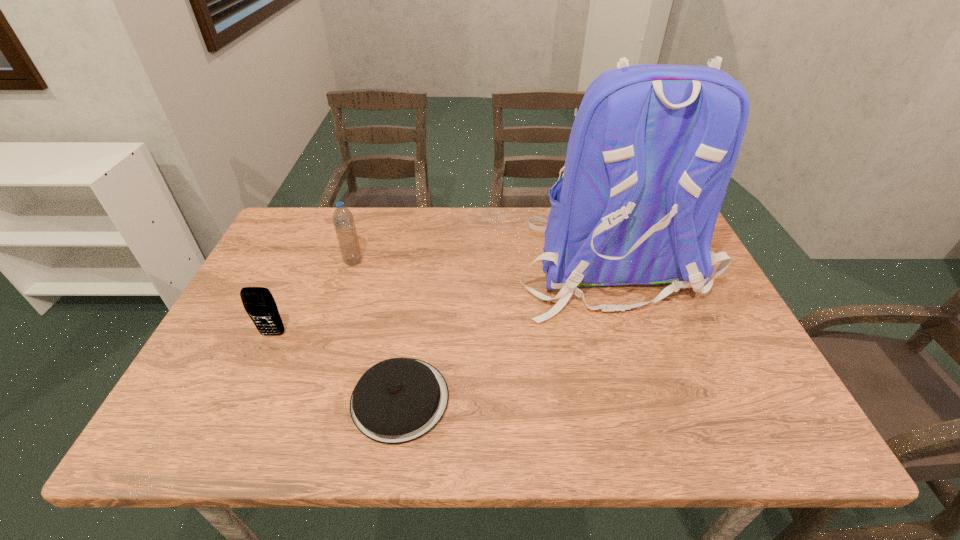
Where is `the rightmost object`? the rightmost object is located at coordinates (652, 148).

The height and width of the screenshot is (540, 960). What are the coordinates of `the tallest object` in the screenshot? It's located at (652, 148).

At what (x,y) coordinates should I click in order to perform the action: click on water bottle. Please return your answer as a coordinate pair (x, y). Looking at the image, I should click on (343, 220).

Identify the location of the third shortest object. This screenshot has width=960, height=540. tap(343, 220).

In order to click on cellular telephone in this screenshot , I will do [x=258, y=302].

Where is `the second shortest object`? This screenshot has height=540, width=960. the second shortest object is located at coordinates (258, 302).

The width and height of the screenshot is (960, 540). What are the coordinates of `the second object from right to left` in the screenshot? It's located at (398, 400).

Find the location of a particular element. pancake is located at coordinates (398, 400).

The width and height of the screenshot is (960, 540). In order to click on blank space located 0.270m on the back of the tallest object in this screenshot , I will do `click(661, 428)`.

The width and height of the screenshot is (960, 540). Find the location of `blank area located 0.240m on the left of the second tallest object`. blank area located 0.240m on the left of the second tallest object is located at coordinates (260, 261).